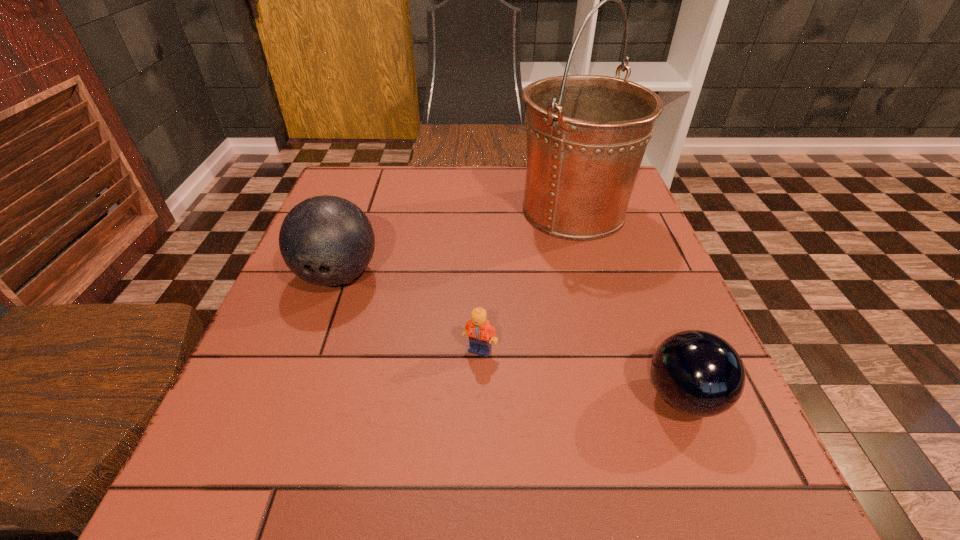
The height and width of the screenshot is (540, 960). Find the location of `bucket`. bucket is located at coordinates [586, 134].

Image resolution: width=960 pixels, height=540 pixels. In order to click on the tallest object in this screenshot , I will do `click(586, 134)`.

You are a GUI agent. You are given a task and a screenshot of the screen. Output one action in this format:
    pyautogui.click(x=<x>, y=<y>)
    Task: Click on the second tallest object
    
    Given the screenshot: What is the action you would take?
    [x=325, y=240]

You are a GUI agent. You are given a task and a screenshot of the screen. Output one action in this format:
    pyautogui.click(x=<x>, y=<y>)
    Task: Click on the taller bowling ball
    This screenshot has width=960, height=540.
    Given the screenshot: What is the action you would take?
    pyautogui.click(x=325, y=240)

The image size is (960, 540). Identify the location of the nearest object. (697, 373).

Image resolution: width=960 pixels, height=540 pixels. In order to click on the nearer bowling ball in this screenshot , I will do `click(697, 373)`.

Locate an element on the screen. the second object from left to right is located at coordinates (481, 334).

I want to click on the shortest object, so click(x=481, y=334).

Locate an element on the screen. Image resolution: width=960 pixels, height=540 pixels. vacant space located 0.330m on the front of the farthest object is located at coordinates (617, 366).

Image resolution: width=960 pixels, height=540 pixels. What are the coordinates of `free space located on the grip area of the second farthest object` in the screenshot? It's located at (297, 390).